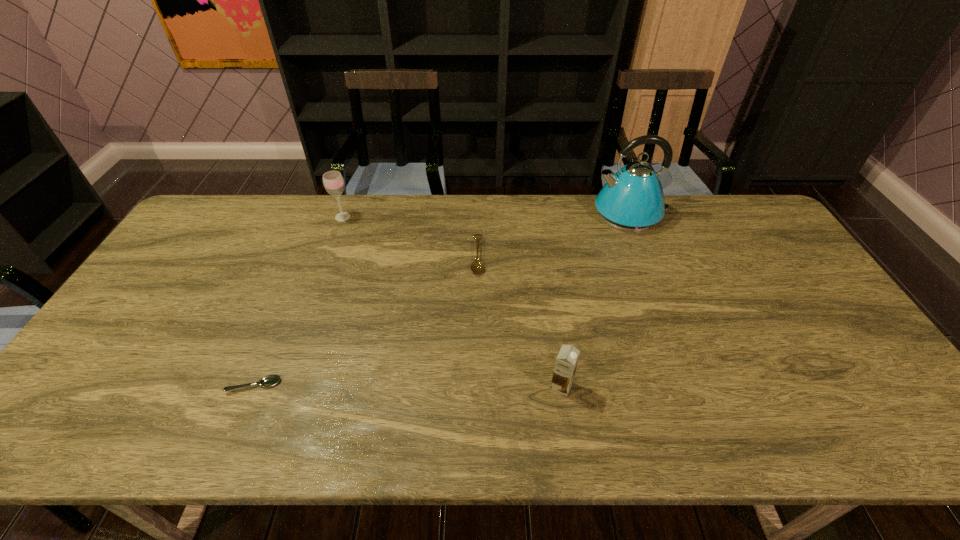
Locate an element on the screen. This screenshot has width=960, height=540. free area in between the wineglass and the tallest object is located at coordinates coord(487,215).

The width and height of the screenshot is (960, 540). I want to click on free spot between the third tallest object and the ladle, so click(x=519, y=321).

Find the location of a particular element. This screenshot has height=540, width=960. vacant space that's between the wineglass and the third shortest object is located at coordinates (452, 301).

Identify the location of empty location between the second tallest object and the fourth tallest object. (410, 237).

The image size is (960, 540). I want to click on free space between the second tallest object and the kettle, so click(x=487, y=215).

Find the location of a particular element. This screenshot has height=540, width=960. free space between the shortest object and the third object from right to left is located at coordinates (366, 321).

Where is `free spot between the second tallest object and the fourth object from left to right`? free spot between the second tallest object and the fourth object from left to right is located at coordinates (452, 301).

I want to click on empty space between the chocolate milk and the third farthest object, so click(x=519, y=321).

Find the location of a particular element. The image size is (960, 540). empty space that is in between the second tallest object and the second shortest object is located at coordinates (410, 237).

Where is `free space between the wineglass and the ladle`? The width and height of the screenshot is (960, 540). free space between the wineglass and the ladle is located at coordinates (410, 237).